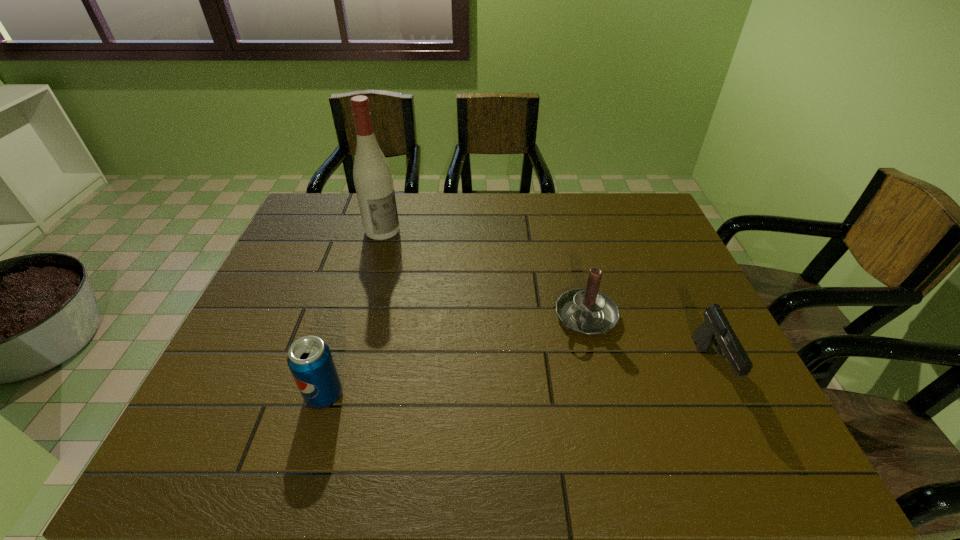
The image size is (960, 540). I want to click on vacant region at the left edge of the desktop, so click(x=301, y=258).

Where is `free space at the right edge of the desktop`? The height and width of the screenshot is (540, 960). free space at the right edge of the desktop is located at coordinates (688, 353).

Where is `vacant region at the far left corner of the desktop`? The width and height of the screenshot is (960, 540). vacant region at the far left corner of the desktop is located at coordinates (324, 208).

Where is `vacant area at the near left corner`? The image size is (960, 540). vacant area at the near left corner is located at coordinates (264, 388).

This screenshot has height=540, width=960. In order to click on free space at the far right corner in this screenshot , I will do `click(623, 218)`.

What are the coordinates of `free space that is in between the second object from right to left and the alcohol` in the screenshot? It's located at (484, 273).

Identify the location of vacant space in between the farthest object and the second object from right to left. (484, 273).

This screenshot has width=960, height=540. Identify the location of vacant region between the candle and the pop soda. (455, 355).

Identify the location of vacant space in between the candle and the pop soda. (455, 355).

Where is `free space between the pop soda and the rightmost object`? free space between the pop soda and the rightmost object is located at coordinates [517, 381].